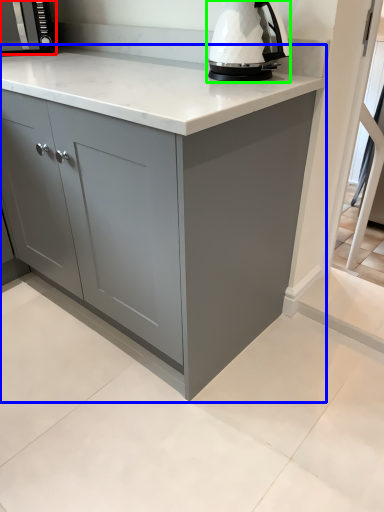
Question: Which object is positioned farthest from kitchen appliance (highlighted by a red box)? Select from cabinetry (highlighted by a blue box) and home appliance (highlighted by a green box).

Choices:
 (A) cabinetry
 (B) home appliance

Answer: (A)